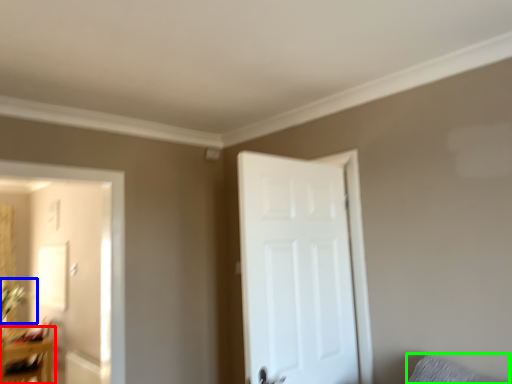
Question: Considering the real-world distances, which object is farthest from table (highlighted by a red box)? plant (highlighted by a blue box) or pillow (highlighted by a green box)?

Choices:
 (A) plant
 (B) pillow

Answer: (B)